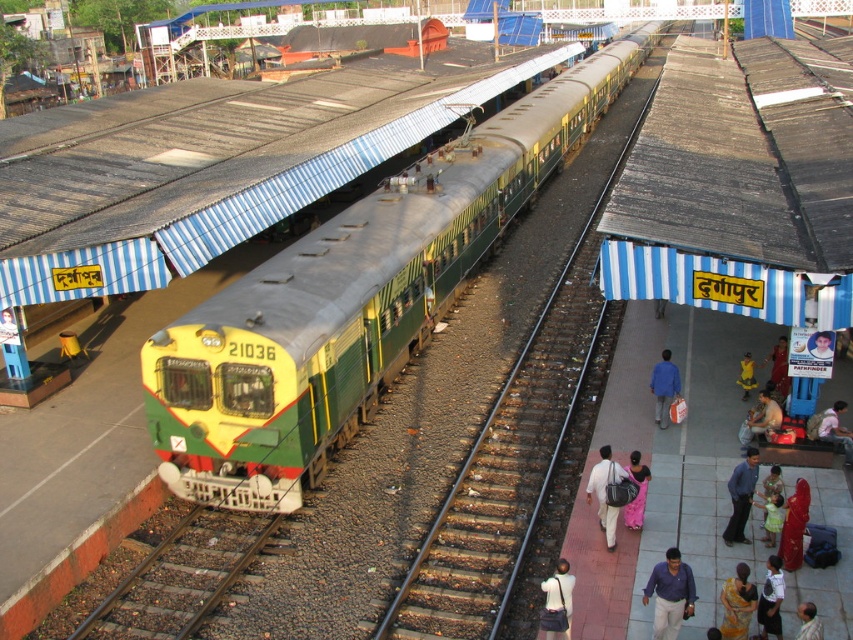
Who is positioned more to the right, blue cotton shirt at lower right or dark brown leather bag at lower center?

From the viewer's perspective, blue cotton shirt at lower right appears more on the right side.

You are a GUI agent. You are given a task and a screenshot of the screen. Output one action in this format:
    pyautogui.click(x=<x>, y=<y>)
    Task: Click on the blue cotton shirt at lower right
    
    Given the screenshot: What is the action you would take?
    pyautogui.click(x=670, y=595)

How distant is green dress at center from yellow fabric bag at center?

green dress at center and yellow fabric bag at center are 6.04 meters apart.

Identify the location of green dress at center. (770, 502).

Measure the distance from brown gravel train track at lower left to yellow fabric bag at center.

brown gravel train track at lower left and yellow fabric bag at center are 12.17 meters apart from each other.

Who is more forward, (167, 536) or (752, 372)?

Point (167, 536)

Does point (231, 516) lie behind point (752, 387)?

No, (231, 516) is closer to viewer.

Where is `brown gravel train track at lower left`? brown gravel train track at lower left is located at coordinates (181, 577).